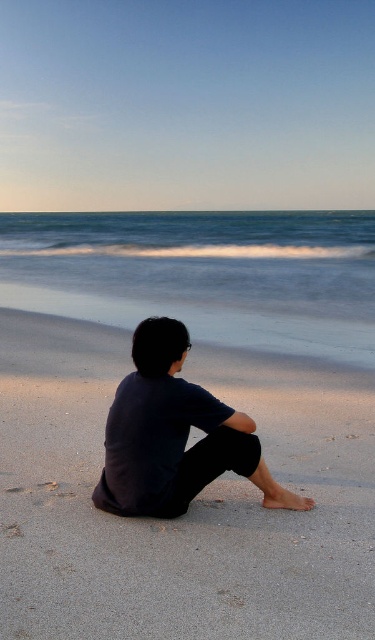
Question: Can you confirm if sandy at lower center is thinner than dark blue fabric at center?

Choices:
 (A) no
 (B) yes

Answer: (B)

Question: Among these objects, which one is nearest to the camera?

Choices:
 (A) dark blue fabric at center
 (B) sandy at lower center

Answer: (B)

Question: Can you confirm if sandy at lower center is wider than dark blue fabric at center?

Choices:
 (A) yes
 (B) no

Answer: (B)

Question: Does sandy at lower center appear under dark blue fabric at center?

Choices:
 (A) yes
 (B) no

Answer: (A)